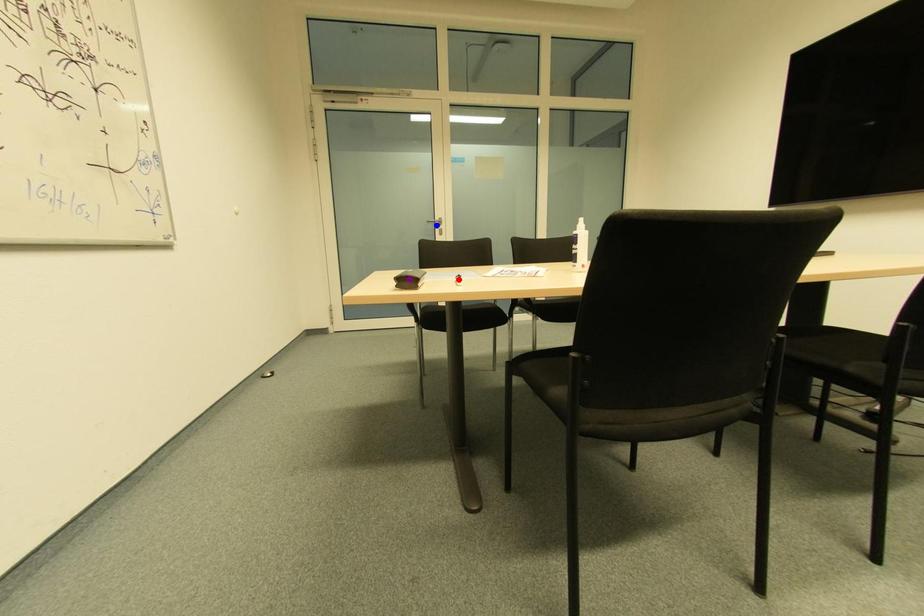
Order these from nearest to farthest:
purple point, blue point, red point

red point < purple point < blue point